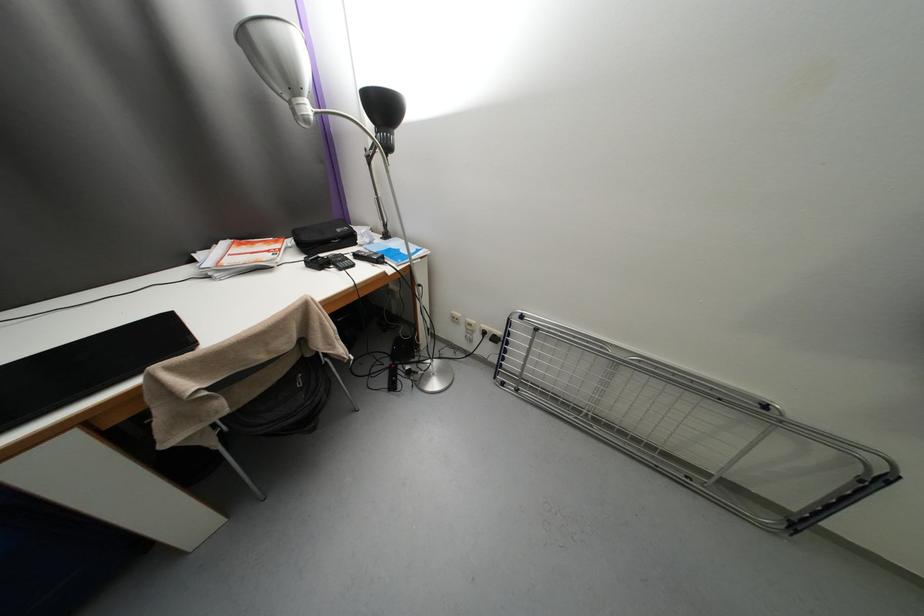
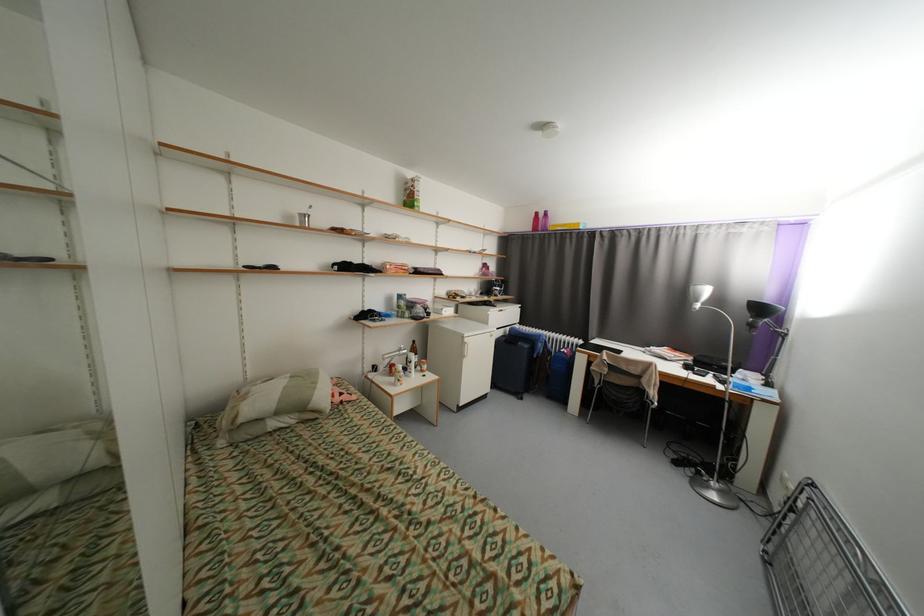
Locate, in the second image, the point that corresponds to the point at 313,108 in the first image.

(703, 306)